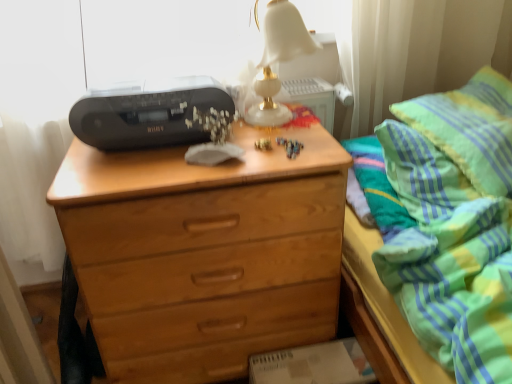
Question: Based on their positions, is white marble table lamp at upper center located to the left or right of green striped pillow at upper right?

Choices:
 (A) right
 (B) left

Answer: (B)

Question: Considering the positions of white marble table lamp at upper center and green striped pillow at upper right in the image, is white marble table lamp at upper center bigger or smaller than green striped pillow at upper right?

Choices:
 (A) big
 (B) small

Answer: (B)

Question: Which object is the closest to the white marble table lamp at upper center?

Choices:
 (A) black plastic printer at upper left
 (B) light brown wood chest of drawers at center
 (C) green striped fabric at upper right
 (D) green striped pillow at upper right

Answer: (A)

Question: Which object is positioned farthest from the green striped pillow at upper right?

Choices:
 (A) light brown wood chest of drawers at center
 (B) white marble table lamp at upper center
 (C) black plastic printer at upper left
 (D) green striped fabric at upper right

Answer: (C)